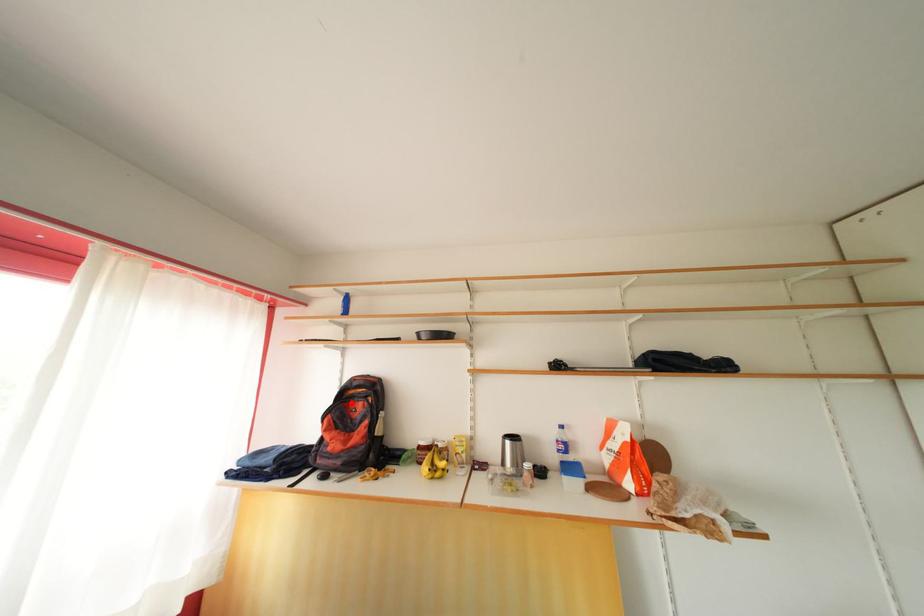
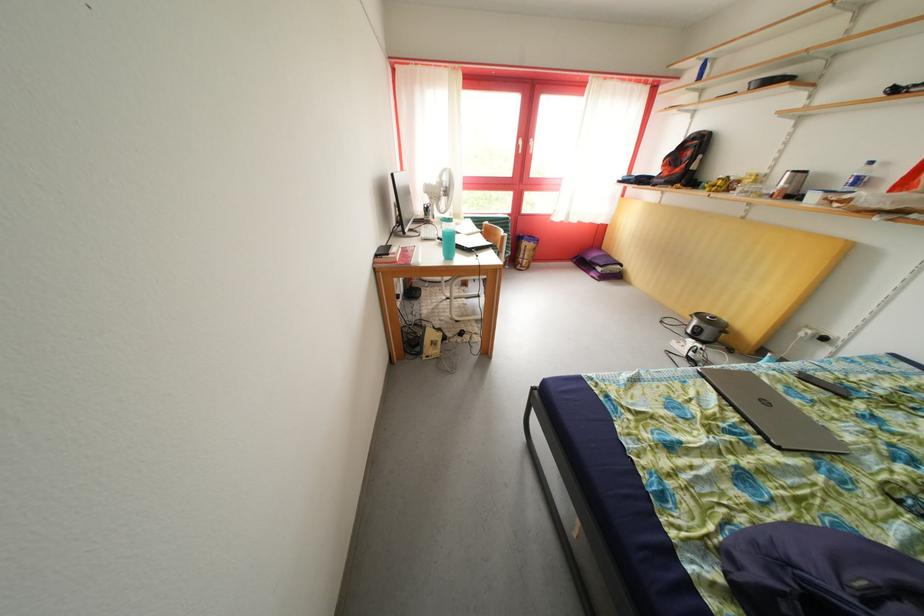
The point at the highlighted location is marked in the first image. Where is the corresponding point in the second image?

(689, 153)